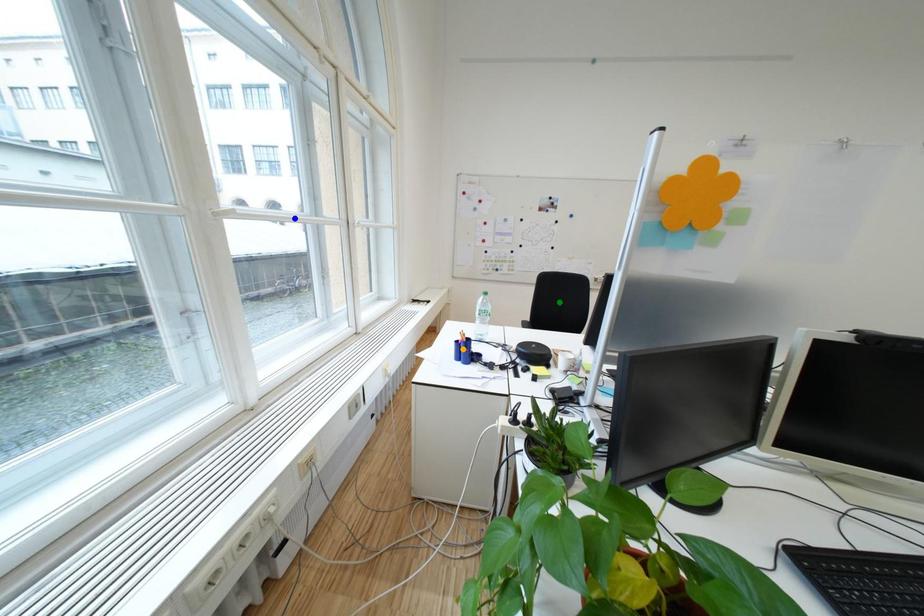
Order these from nearest to farthest:
A) orange point
B) green point
C) blue point

orange point, blue point, green point